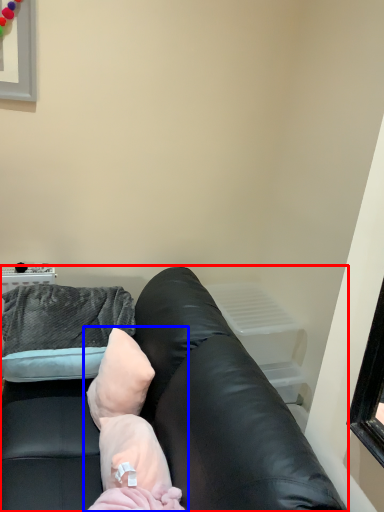
Question: Which point is closer to the camera, studio couch (highlighted by a red box) or newborn (highlighted by a blue box)?

Choices:
 (A) studio couch
 (B) newborn

Answer: (A)